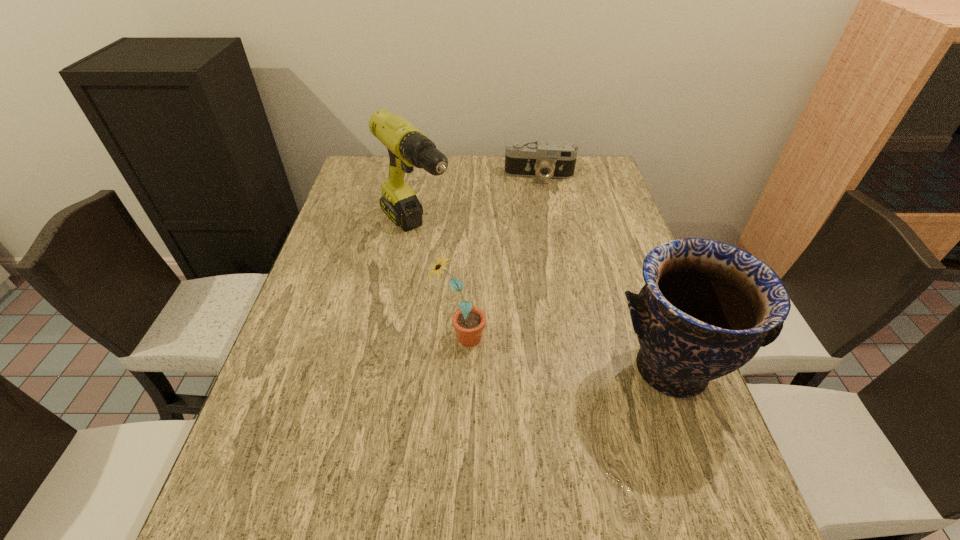
Locate an element on the screen. The width and height of the screenshot is (960, 540). free spot between the drill and the pottery is located at coordinates (542, 301).

Find the location of a particular element. empty location between the pottery and the sunflower is located at coordinates (564, 354).

The width and height of the screenshot is (960, 540). I want to click on vacant space in between the third nearest object and the sunflower, so click(438, 285).

This screenshot has width=960, height=540. Find the location of `free area in between the camera and the sunflower`. free area in between the camera and the sunflower is located at coordinates (500, 256).

The height and width of the screenshot is (540, 960). I want to click on vacant area that lies between the pottery and the third nearest object, so click(542, 301).

Point out which object is positioned as the second nearest to the drill. Please provide its 2D coordinates. Your answer should be formatted as a tuple, i.e. [(x, y)], where the tuple contains the x and y coordinates of a point satisfying the conditions above.

[(468, 321)]

Where is `object that is the nearest to the shortest object`? object that is the nearest to the shortest object is located at coordinates (407, 146).